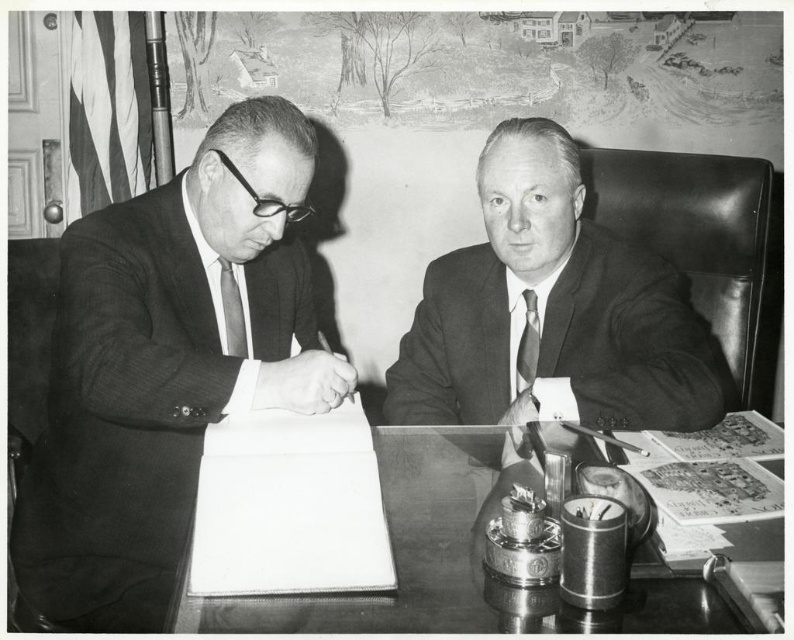
You are an interior designer assessing the office layout. The shiny metal desk at center and the striped fabric tie at left are both in view. Which object has a greater height?

The striped fabric tie at left is taller than the shiny metal desk at center.

You are an office worker who needs to place a 1.5 meter wide document on the shiny metal desk at center. Considering the desk and the striped fabric tie at left, can the document fit on the desk?

The shiny metal desk at center is wider than the striped fabric tie at left, so the desk is likely wide enough to accommodate a 1.5 meter wide document.